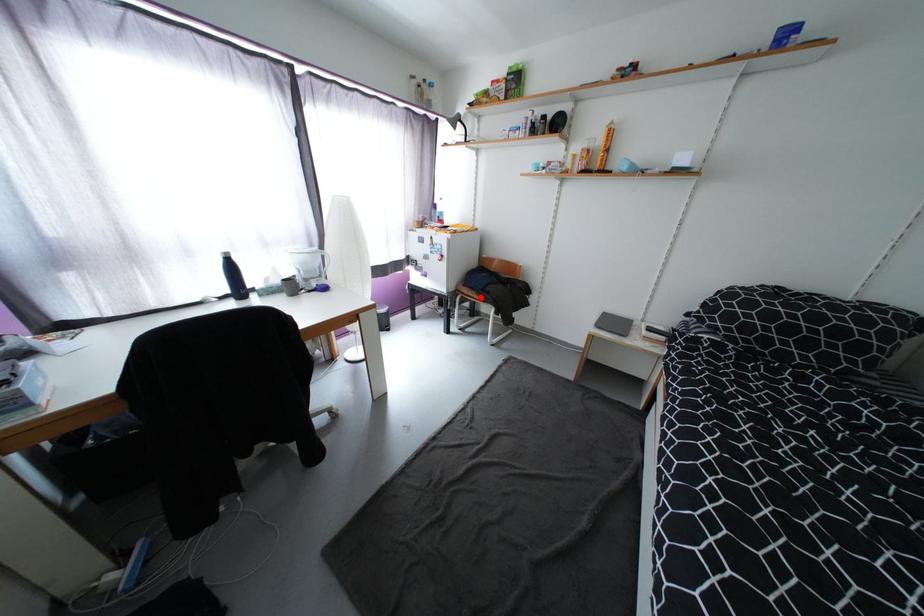
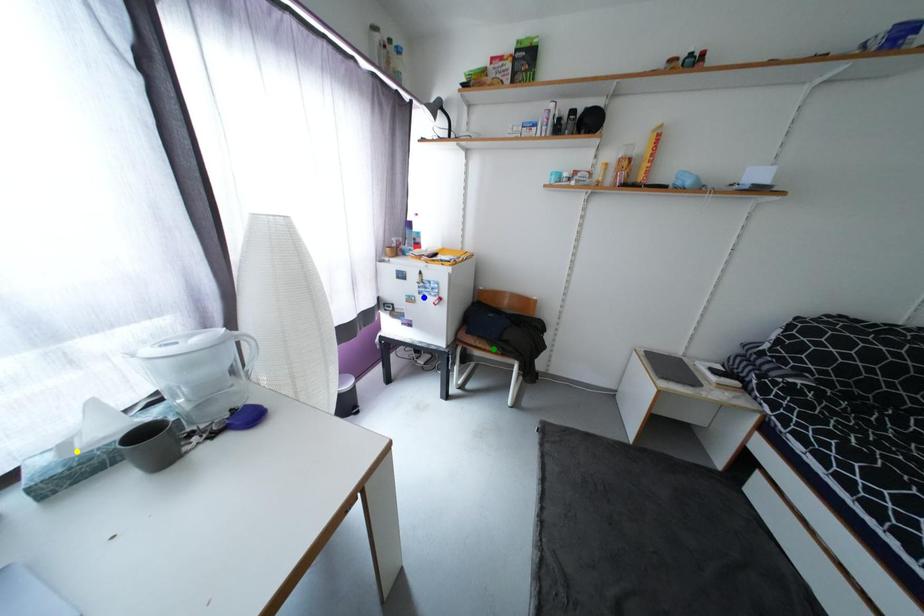
Question: I am providing you with two images of the same scene from different viewpoints. A red point is marked on the first image. You are given multiple points on the second image. Which point in image 2 represents the same 3d spot as the red point in image 1?

Choices:
 (A) yellow point
 (B) green point
 (C) blue point

Answer: (B)